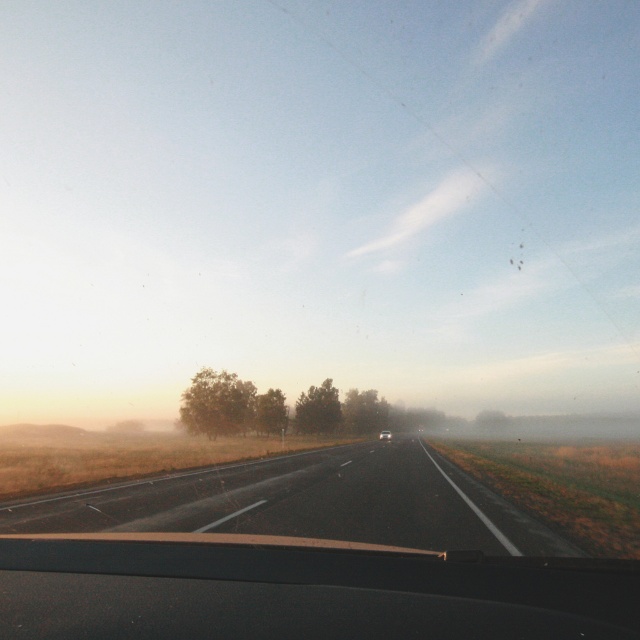
Question: Which point is farther to the camera?

Choices:
 (A) (404, 522)
 (B) (385, 435)

Answer: (B)

Question: Is black asphalt highway at center smaller than matte black car at center?

Choices:
 (A) yes
 (B) no

Answer: (B)

Question: Which point is closer to the camera taking this photo?

Choices:
 (A) (381, 429)
 (B) (259, 522)

Answer: (B)

Question: Is black asphalt highway at center closer to camera compared to matte black car at center?

Choices:
 (A) no
 (B) yes

Answer: (B)

Question: Does black asphalt highway at center have a greater width compared to matte black car at center?

Choices:
 (A) no
 (B) yes

Answer: (B)